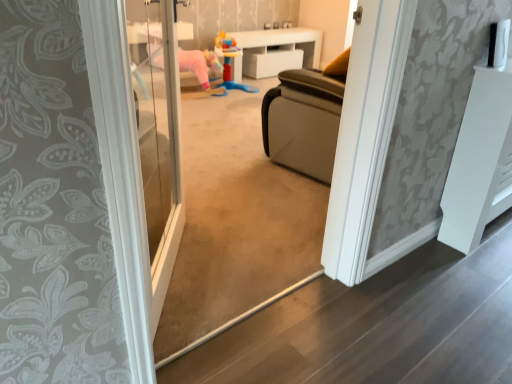
Question: Which direction should I rotate to look at white glossy cabinet at upper center, the first furniture when ordered from back to front?

Choices:
 (A) right
 (B) left

Answer: (A)

Question: Is white glossy cabinet at upper center, the first furniture when ordered from back to front, located within plastic colorful toy at center?

Choices:
 (A) no
 (B) yes

Answer: (A)

Question: Is plastic colorful toy at center at the left side of white glossy cabinet at upper center, which is the 2th furniture in bottom-to-top order?

Choices:
 (A) yes
 (B) no

Answer: (A)

Question: Is plastic colorful toy at center oriented away from white glossy cabinet at upper center, the first furniture when ordered from back to front?

Choices:
 (A) yes
 (B) no

Answer: (B)

Question: Is plastic colorful toy at center oriented towards white glossy cabinet at upper center, the first furniture when ordered from back to front?

Choices:
 (A) no
 (B) yes

Answer: (A)

Question: From the image's perspective, would you say plastic colorful toy at center is positioned over white glossy cabinet at upper center, the second furniture positioned from the front?

Choices:
 (A) no
 (B) yes

Answer: (A)

Question: Is plastic colorful toy at center completely or partially outside of white glossy cabinet at upper center, the 1th furniture positioned from the top?

Choices:
 (A) yes
 (B) no

Answer: (A)

Question: Considering the relative sizes of white matte radiator at right, which ranks as the first furniture in front-to-back order, and plastic colorful toy at center in the image provided, is white matte radiator at right, which ranks as the first furniture in front-to-back order, shorter than plastic colorful toy at center?

Choices:
 (A) no
 (B) yes

Answer: (A)

Question: Is white matte radiator at right, marked as the second furniture in a left-to-right arrangement, to the left of plastic colorful toy at center from the viewer's perspective?

Choices:
 (A) yes
 (B) no

Answer: (B)

Question: Does white matte radiator at right, which appears as the 2th furniture when viewed from the back, have a greater width compared to plastic colorful toy at center?

Choices:
 (A) no
 (B) yes

Answer: (A)

Question: From a real-world perspective, is white matte radiator at right, which ranks as the first furniture in front-to-back order, physically below plastic colorful toy at center?

Choices:
 (A) yes
 (B) no

Answer: (B)

Question: Considering the relative sizes of white matte radiator at right, which appears as the 2th furniture when viewed from the back, and plastic colorful toy at center in the image provided, is white matte radiator at right, which appears as the 2th furniture when viewed from the back, bigger than plastic colorful toy at center?

Choices:
 (A) no
 (B) yes

Answer: (B)

Question: Does white matte radiator at right, the first furniture in the right-to-left sequence, turn towards plastic colorful toy at center?

Choices:
 (A) yes
 (B) no

Answer: (B)

Question: Considering the relative sizes of white glossy cabinet at upper center, the first furniture when ordered from back to front, and plastic colorful toy at center in the image provided, is white glossy cabinet at upper center, the first furniture when ordered from back to front, thinner than plastic colorful toy at center?

Choices:
 (A) yes
 (B) no

Answer: (A)